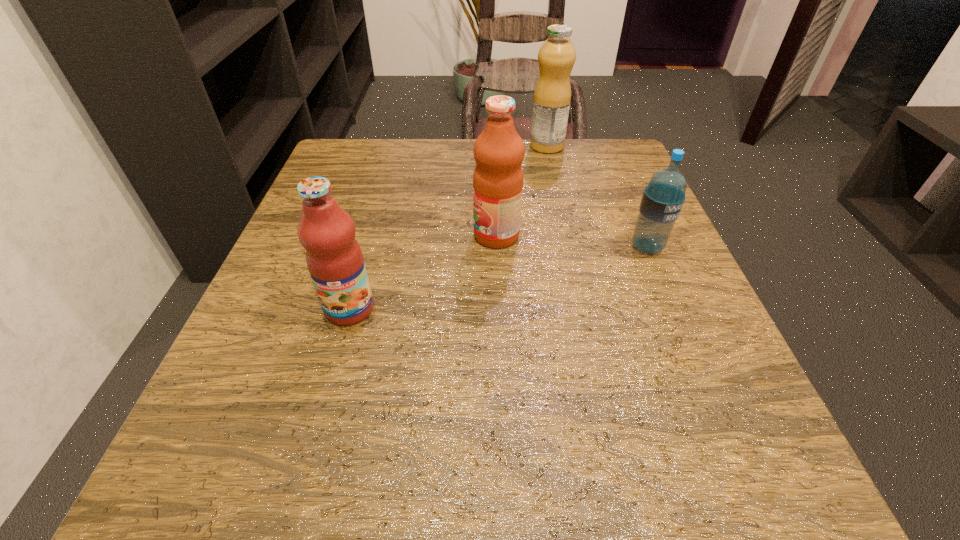
Identify the location of free location located on the front label of the farthest object. (443, 146).

Find the location of a particular element. This screenshot has width=960, height=540. vacant region located on the front label of the second fruit juice from right to left is located at coordinates (306, 235).

At what (x,y) coordinates should I click in order to perform the action: click on vacant space located 0.140m on the front label of the second fruit juice from right to left. Please return your answer as a coordinate pair (x, y). Looking at the image, I should click on (397, 235).

Identify the location of free space located 0.270m on the front label of the second fruit juice from right to left. The image size is (960, 540). (327, 235).

Identify the location of vacant area situated 0.180m on the front label of the nearest fruit juice. The width and height of the screenshot is (960, 540). (311, 444).

Locate an element on the screen. This screenshot has height=540, width=960. vacant position located 0.060m on the back of the water bottle is located at coordinates (635, 216).

The image size is (960, 540). I want to click on object positioned at the far edge, so click(552, 96).

This screenshot has width=960, height=540. In order to click on object that is at the left edge in this screenshot , I will do `click(334, 258)`.

Find the location of a particular element. fruit juice that is positioned at the right edge is located at coordinates (552, 96).

Identify the location of water bottle that is at the right edge. Image resolution: width=960 pixels, height=540 pixels. (663, 198).